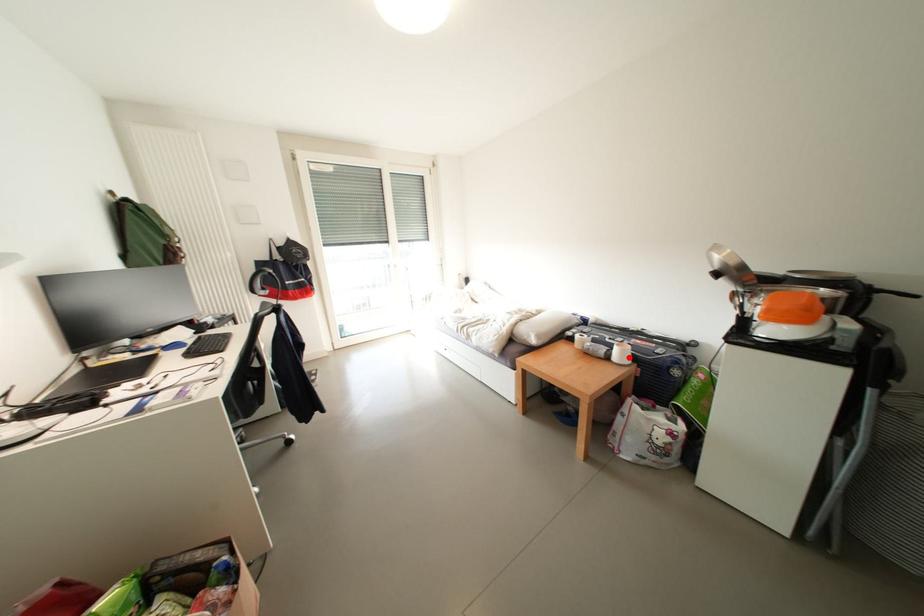
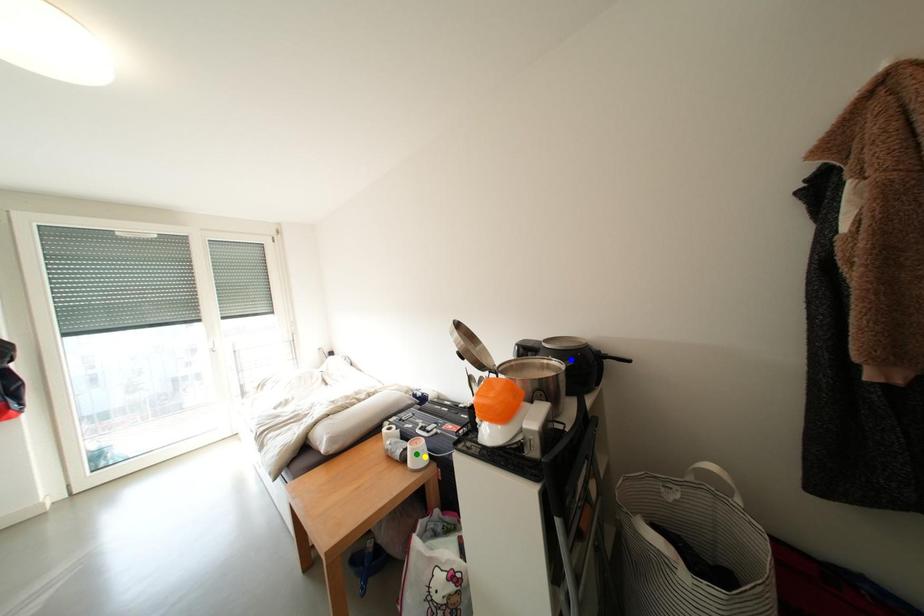
Question: I am providing you with two images of the same scene from different viewpoints. A red point is marked on the first image. You are given multiple points on the second image. Can you choose the point in image 2 that corresponds to the point in image 1?

Choices:
 (A) green point
 (B) yellow point
 (C) blue point

Answer: (B)